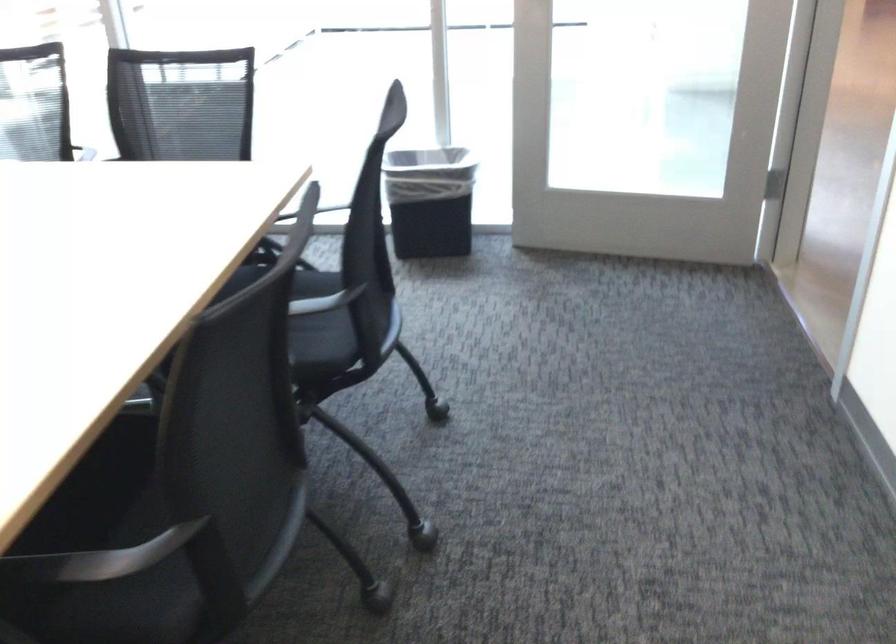
The location [429,201] corresponds to which object?

It refers to a black trash can.